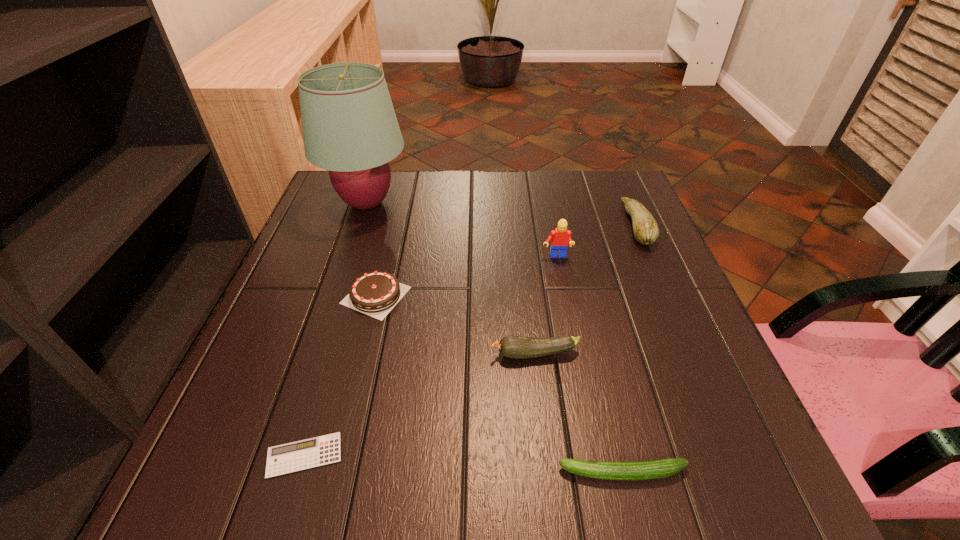
At what (x,y) coordinates should I click in order to perform the action: click on vacant point located 0.060m on the right of the chocolate cake. Please return your answer as a coordinate pair (x, y). Looking at the image, I should click on click(438, 295).

The width and height of the screenshot is (960, 540). I want to click on free space located on the front-facing side of the shortest zucchini, so click(371, 472).

Locate an element on the screen. Image resolution: width=960 pixels, height=540 pixels. vacant region located 0.090m on the front-facing side of the shortest zucchini is located at coordinates (501, 472).

This screenshot has height=540, width=960. In order to click on free space located on the front-facing side of the shortest zucchini in this screenshot , I will do `click(371, 472)`.

Locate an element on the screen. The width and height of the screenshot is (960, 540). vacant area located on the back of the shortest object is located at coordinates tap(345, 319).

Where is `lampshade at the far edge`? The width and height of the screenshot is (960, 540). lampshade at the far edge is located at coordinates (350, 128).

The width and height of the screenshot is (960, 540). I want to click on zucchini that is at the far edge, so click(646, 231).

Find the location of a particular element. The height and width of the screenshot is (540, 960). zucchini at the near edge is located at coordinates pyautogui.click(x=642, y=470).

Where is `calculator at the near edge`? calculator at the near edge is located at coordinates (300, 455).

Locate an element on the screen. lampshade that is at the left edge is located at coordinates (350, 128).